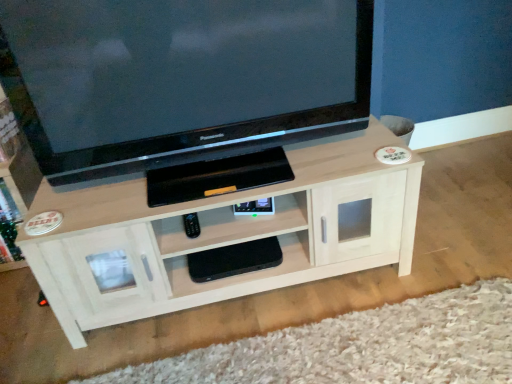
Identify the location of free space above light wood shelf at center, marked as the second shelf in a bottom-to-top arrangement (from a real-world perspective). This screenshot has height=384, width=512. (225, 175).